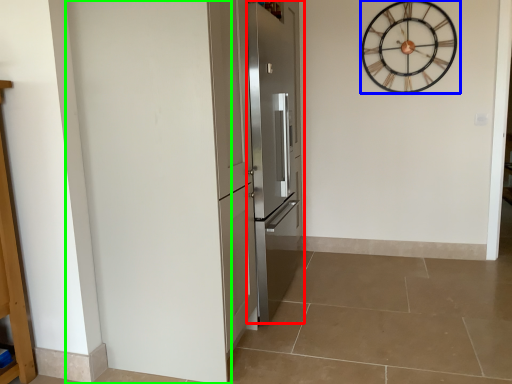
Question: Which is nearer to the door (highlighted by a red box)? wall clock (highlighted by a blue box) or door (highlighted by a green box).

Choices:
 (A) wall clock
 (B) door

Answer: (B)